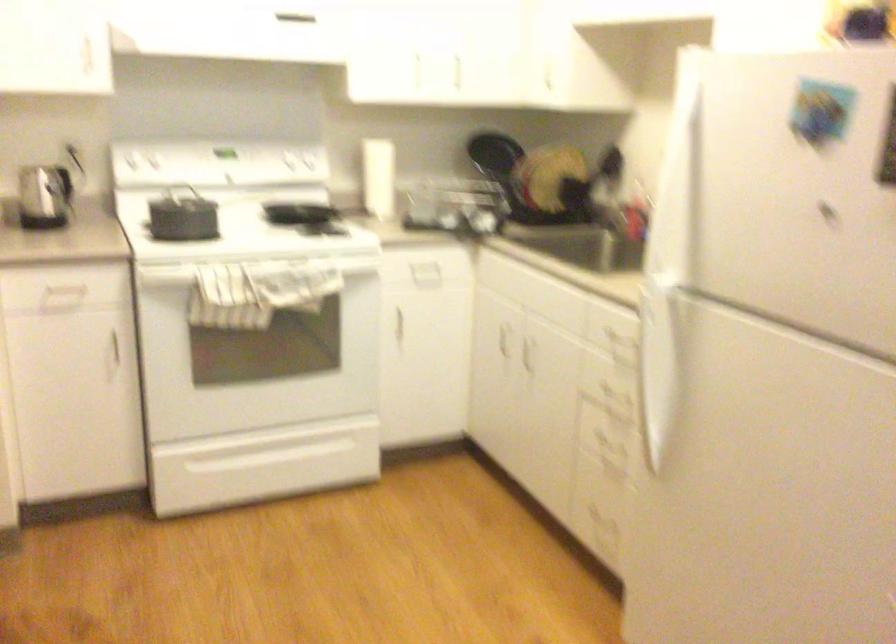
In order to click on white oven handle in this screenshot , I will do `click(263, 446)`.